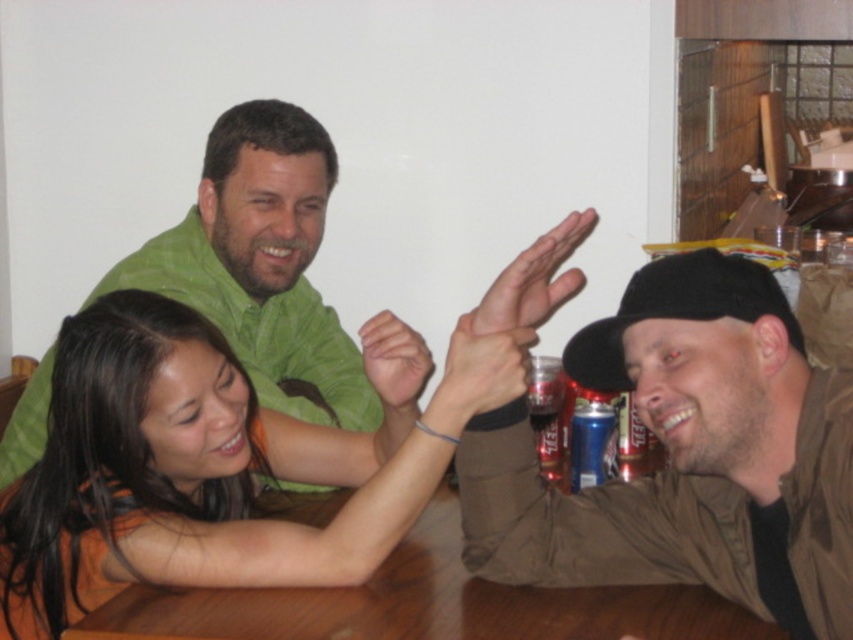
Question: Is brown cotton cap at upper right below green matte shirt at upper left?

Choices:
 (A) no
 (B) yes

Answer: (B)

Question: Can you confirm if orange fabric shirt at center is wider than brown wooden table at center?

Choices:
 (A) yes
 (B) no

Answer: (B)

Question: Among these points, which one is nearest to the camera?

Choices:
 (A) (28, 490)
 (B) (614, 612)
 (C) (265, 173)

Answer: (B)

Question: Among these points, which one is nearest to the camera?

Choices:
 (A) (308, 394)
 (B) (402, 595)

Answer: (B)

Question: Observing the image, what is the correct spatial positioning of green matte shirt at upper left in reference to brown wooden table at center?

Choices:
 (A) below
 (B) above

Answer: (B)

Question: Estimate the real-world distances between objects in this image. Which object is farther from the orange fabric shirt at center?

Choices:
 (A) brown wooden table at center
 (B) brown cotton cap at upper right

Answer: (B)